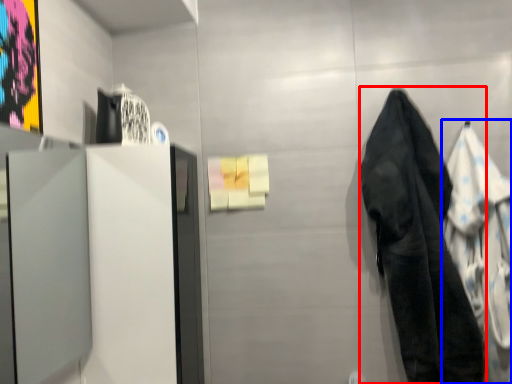
Question: Which point is closer to the camera, towel/napkin (highlighted by a red box) or cloak (highlighted by a blue box)?

Choices:
 (A) towel/napkin
 (B) cloak

Answer: (A)